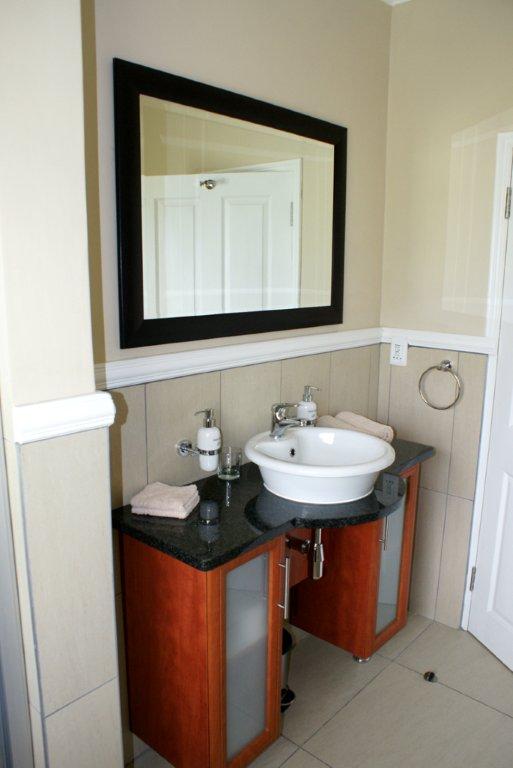
In order to click on cabinet in this screenshot , I will do `click(198, 666)`.